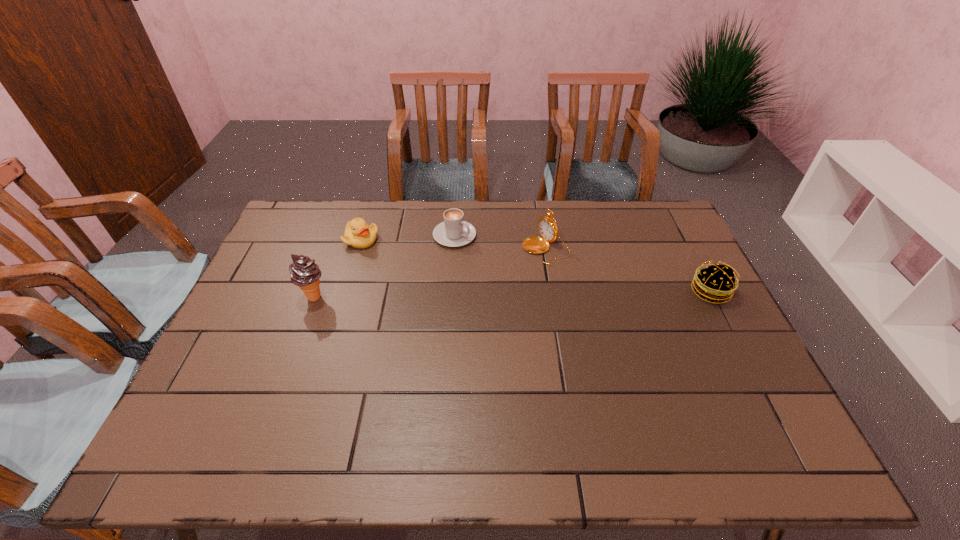
Locate an element on the screen. This screenshot has width=960, height=540. free space on the desktop that is between the tallest object and the rightmost object and is positioned to the right of the third object from right to left is located at coordinates (561, 293).

You are a GUI agent. You are given a task and a screenshot of the screen. Output one action in this format:
    pyautogui.click(x=<x>, y=<y>)
    Task: Click on the free space on the desktop that is between the tallest object and the patty and is positioned on the face of the second object from right to left
    The width and height of the screenshot is (960, 540).
    Given the screenshot: What is the action you would take?
    pyautogui.click(x=455, y=295)

This screenshot has height=540, width=960. I want to click on vacant spot on the desktop that is between the tallest object and the patty and is positioned at the face of the duckling, so click(476, 294).